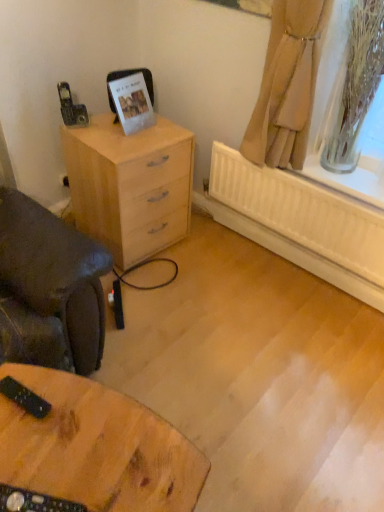
The width and height of the screenshot is (384, 512). Identify the location of blank space situated above wooden table at lower left (from a real-world perspective). (76, 440).